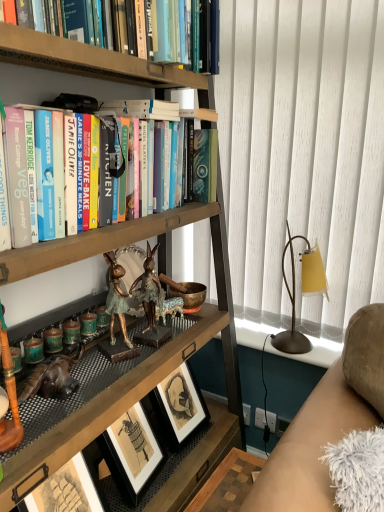
Question: From the image's perspective, is matte gold table lamp at right located above or below white fabric curtain at right?

Choices:
 (A) above
 (B) below

Answer: (B)

Question: Is point pos(317,271) closer or farther from the camera than point pos(360,4)?

Choices:
 (A) farther
 (B) closer

Answer: (A)

Question: Estimate the real-world distances between objects in this image. Which object is farther from the hardcover books at upper left?

Choices:
 (A) wooden bookshelf at center
 (B) white fabric curtain at right
 (C) suede-like beige couch at lower right
 (D) gold metallic rabbit at center
 (E) matte gold table lamp at right

Answer: (C)

Question: Estimate the real-world distances between objects in this image. Which object is farther from the wooden bookshelf at center?

Choices:
 (A) white fabric curtain at right
 (B) gold metallic rabbit at center
 (C) suede-like beige couch at lower right
 (D) matte gold table lamp at right
 (E) hardcover books at upper left

Answer: (C)